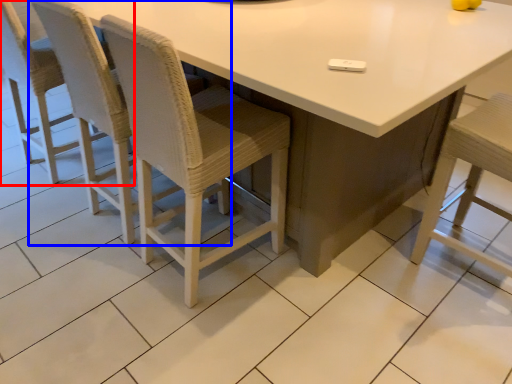
Question: Which object appears closest to the camera in this image, chair (highlighted by a red box) or chair (highlighted by a blue box)?

Choices:
 (A) chair
 (B) chair

Answer: (B)